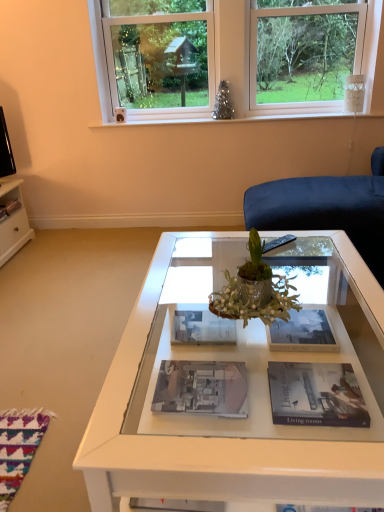
You are a GUI agent. You are given a task and a screenshot of the screen. Output one action in this format:
    pyautogui.click(x=<x>, y=<y>)
    Task: Click on the free space above matte black book at center, which is counted as the fourth magazine, starting from the right (from a real-world perspective)
    The height and width of the screenshot is (512, 384).
    Given the screenshot: What is the action you would take?
    pyautogui.click(x=201, y=384)